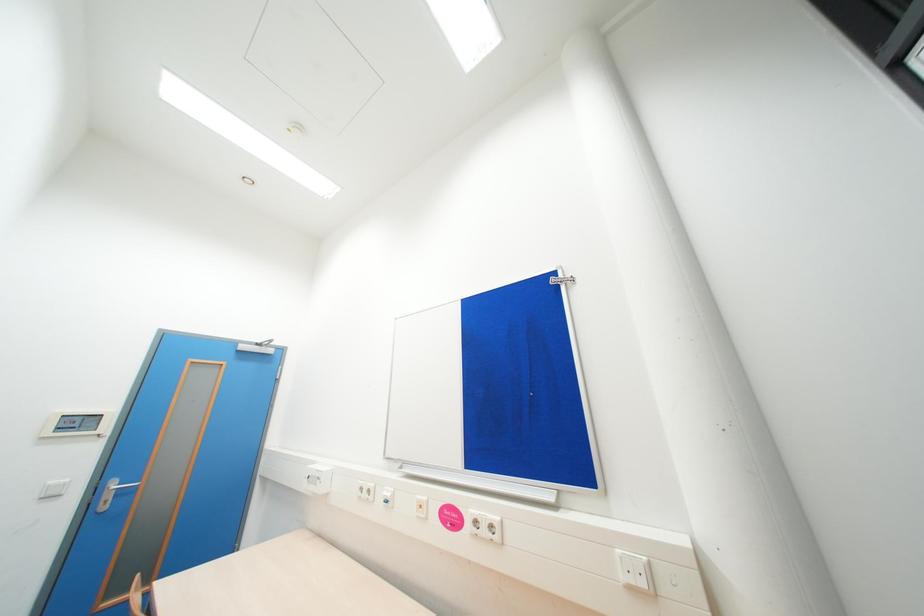
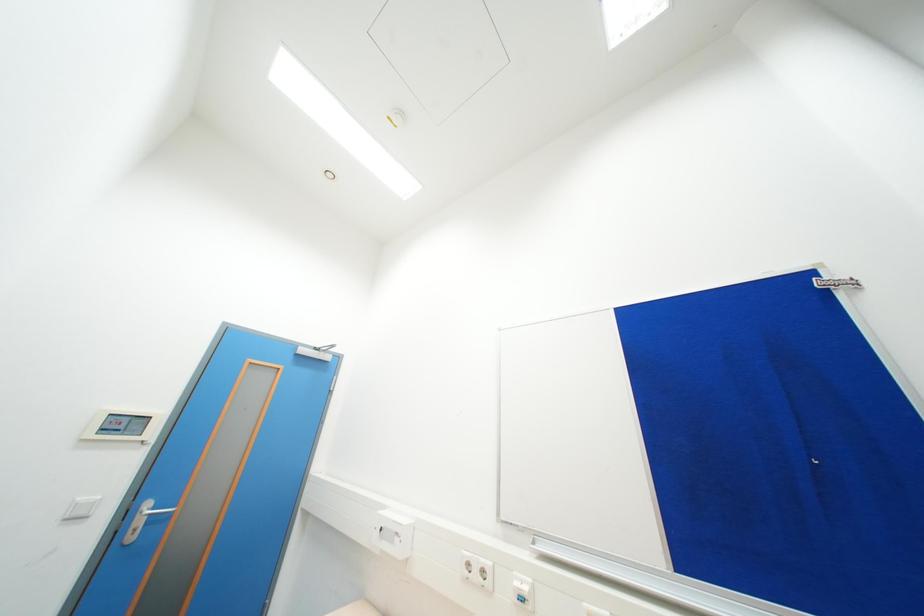
Which direction would the cameraman need to move to produce the second image?

The movement direction of the cameraman is left, forward.